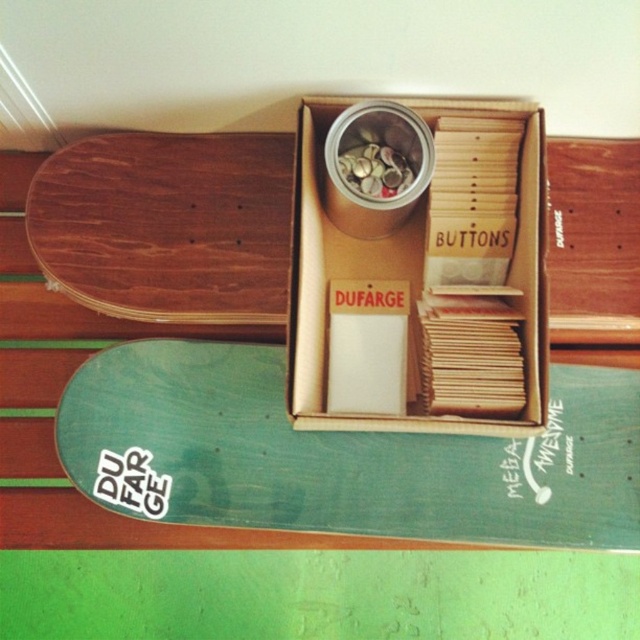
Question: Which point is farther to the camera?

Choices:
 (A) (49, 202)
 (B) (163, 408)
 (C) (426, 432)

Answer: (B)

Question: Which point is closer to the camera taking this photo?

Choices:
 (A) (378, 380)
 (B) (220, 145)

Answer: (A)

Question: Which point is closer to the camera taking this photo?

Choices:
 (A) (131, 195)
 (B) (492, 502)

Answer: (B)

Question: Can you confirm if brown cardboard box at center is positioned below wooden skateboard at upper left?

Choices:
 (A) no
 (B) yes

Answer: (B)

Question: Does brown cardboard box at center come in front of wooden skateboard at upper left?

Choices:
 (A) yes
 (B) no

Answer: (A)

Question: From the image, what is the correct spatial relationship of brown cardboard box at center in relation to wooden skateboard at upper left?

Choices:
 (A) above
 (B) below

Answer: (B)